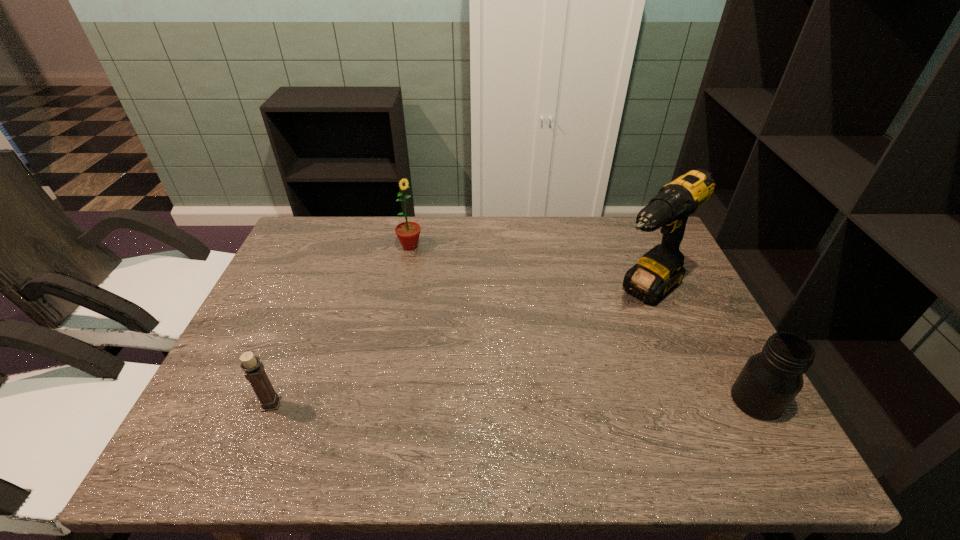
Where is `vacant space on the desktop that is between the leftmost object and the jar and is positioned at the tip of the tallest object`? This screenshot has width=960, height=540. vacant space on the desktop that is between the leftmost object and the jar and is positioned at the tip of the tallest object is located at coordinates (526, 402).

At what (x,y) coordinates should I click in order to perform the action: click on vacant space on the desktop that is between the candle holder and the jar and is positioned on the face of the farthest object. Please return your answer as a coordinate pair (x, y). The width and height of the screenshot is (960, 540). Looking at the image, I should click on (562, 402).